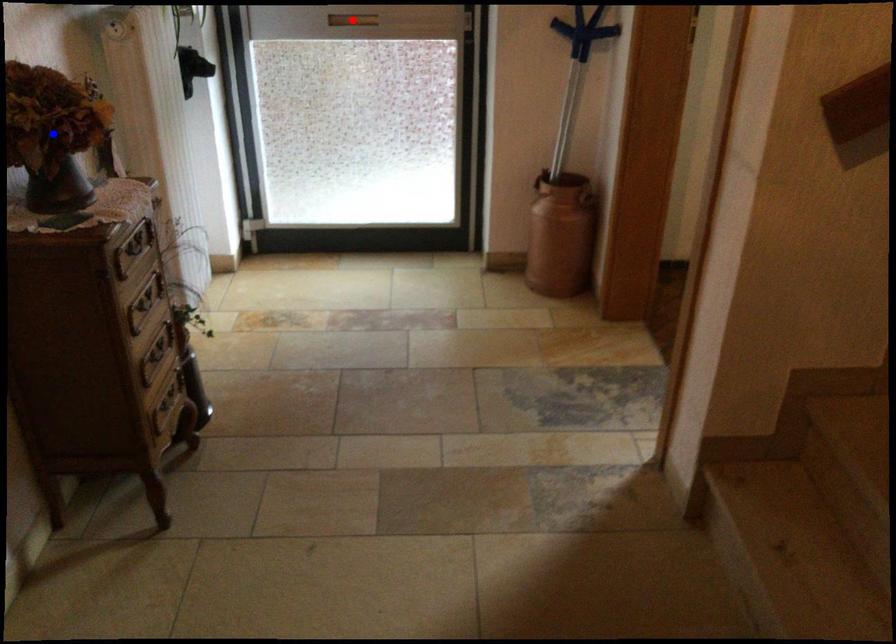
Question: Which of the two points in the image is closer to the camera?

Choices:
 (A) Blue point is closer.
 (B) Red point is closer.

Answer: (A)